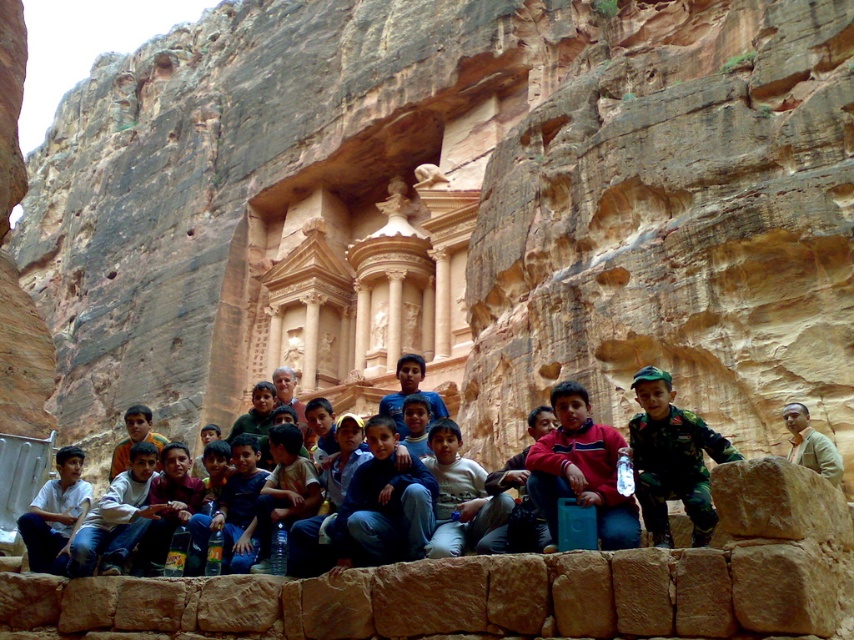
Is red fleece jacket at center to the right of light brown leather jacket at center from the viewer's perspective?

Incorrect, red fleece jacket at center is not on the right side of light brown leather jacket at center.

Can you confirm if red fleece jacket at center is bigger than light brown leather jacket at center?

Indeed, red fleece jacket at center has a larger size compared to light brown leather jacket at center.

Locate an element on the screen. This screenshot has height=640, width=854. red fleece jacket at center is located at coordinates (581, 468).

Locate an element on the screen. Image resolution: width=854 pixels, height=640 pixels. red fleece jacket at center is located at coordinates point(581,468).

Can you confirm if camouflage uniform at center is positioned above light brown leather jacket at center?

Correct, camouflage uniform at center is located above light brown leather jacket at center.

I want to click on camouflage uniform at center, so click(x=671, y=458).

Measure the distance between camouflage uniform at center and camera.

camouflage uniform at center and camera are 40.05 meters apart.

At what (x,y) coordinates should I click in order to perform the action: click on camouflage uniform at center. Please return your answer as a coordinate pair (x, y). The image size is (854, 640). Looking at the image, I should click on (671, 458).

Is camouflage uniform at center smaller than red fleece jacket at center?

No.

Which is more to the right, camouflage uniform at center or red fleece jacket at center?

camouflage uniform at center

Is point (683, 484) farther from viewer compared to point (560, 483)?

Yes, point (683, 484) is farther from viewer.

The height and width of the screenshot is (640, 854). I want to click on camouflage uniform at center, so click(x=671, y=458).